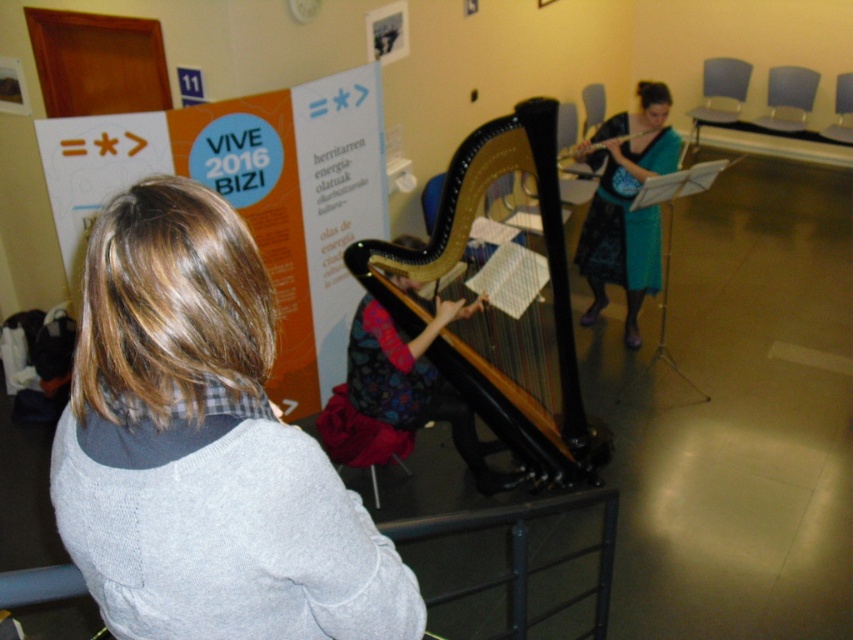
Which is behind, point (384, 307) or point (645, 173)?

Point (645, 173)

Does wooden harp at center have a larger size compared to teal fabric skirt at center?

Indeed, wooden harp at center has a larger size compared to teal fabric skirt at center.

Is point (395, 289) positioned in front of point (616, 170)?

Yes, point (395, 289) is closer to viewer.

Find the location of `wooden harp at center`. wooden harp at center is located at coordinates (500, 307).

Can you confirm if wooden harp at center is positioned below wooden flute at upper right?

Indeed, wooden harp at center is positioned under wooden flute at upper right.

Between point (540, 160) and point (653, 132), which one is positioned behind?

Point (653, 132)

The width and height of the screenshot is (853, 640). Describe the element at coordinates (500, 307) in the screenshot. I see `wooden harp at center` at that location.

Where is `wooden harp at center`? The height and width of the screenshot is (640, 853). wooden harp at center is located at coordinates (500, 307).

Is point (639, 241) less distant than point (587, 150)?

No, (639, 241) is further to viewer.

Is teal fabric skirt at center to the left of wooden flute at upper right from the viewer's perspective?

No, teal fabric skirt at center is not to the left of wooden flute at upper right.

Locate an element on the screen. teal fabric skirt at center is located at coordinates (625, 205).